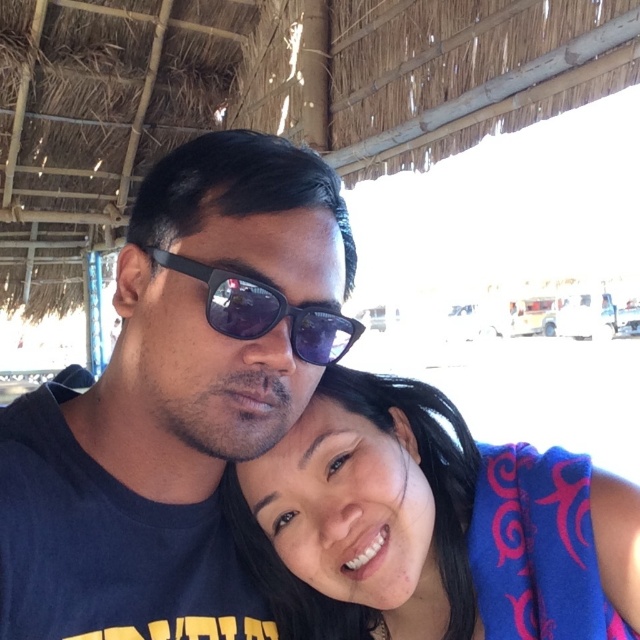
Question: Is blue fabric towel at lower right wider than black matte sunglasses at center?

Choices:
 (A) no
 (B) yes

Answer: (B)

Question: Does matte black sunglasses at upper center have a greater width compared to blue fabric towel at lower right?

Choices:
 (A) no
 (B) yes

Answer: (A)

Question: Is matte black sunglasses at upper center above black matte sunglasses at center?

Choices:
 (A) yes
 (B) no

Answer: (B)

Question: Which object is positioned closest to the black matte sunglasses at center?

Choices:
 (A) blue fabric towel at lower right
 (B) matte black sunglasses at upper center

Answer: (B)

Question: Among these points, which one is nearest to the camera?

Choices:
 (A) (310, 490)
 (B) (132, 368)

Answer: (B)

Question: Which object is closer to the camera taking this photo?

Choices:
 (A) blue fabric towel at lower right
 (B) matte black sunglasses at upper center
 (C) black matte sunglasses at center

Answer: (C)